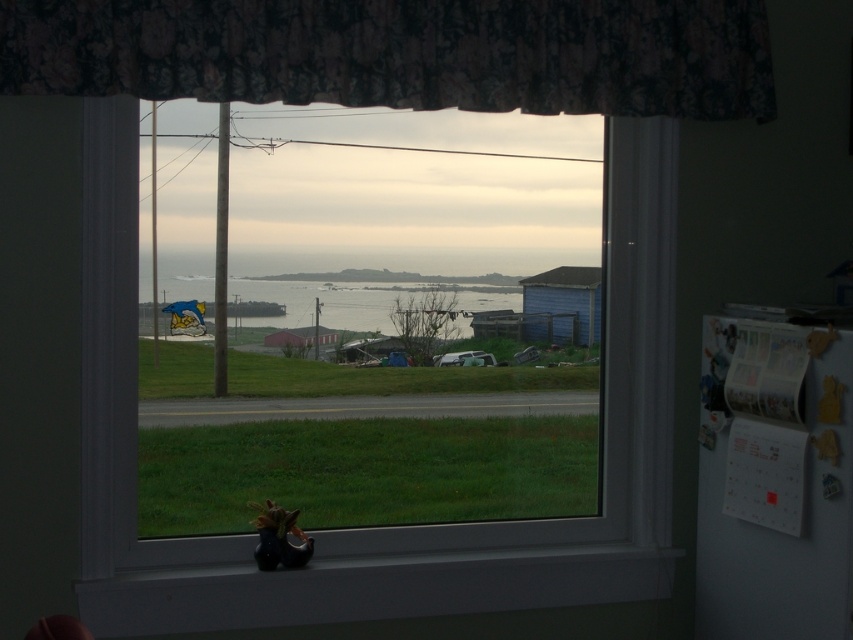
You are an interior designer assessing the placement of the floral fabric curtain at upper center in the window frame. Based on its coordinates, is it positioned closer to the top or bottom edge of the window?

The floral fabric curtain at upper center is located at point (x=402, y=52), which means it is closer to the top edge of the window since the y coordinate is less than 0.5.

Looking at this image, you are an interior designer assessing the room. You need to place a 1.2 meter wide painting on the wall where the transparent glass window at center is located. Given the window and the clear water at center, will the painting fit horizontally without overlapping them?

The transparent glass window at center is wider than the clear water at center. However, the question mentions placing the painting on the wall where the window is located. Since the window itself is part of the wall, the painting must be placed around or beside it. The description does not provide the exact dimensions of the wall or the window, so it is unclear if there is enough space. Please check the actual measurements before deciding.

You are an interior designer assessing the window decorations. You need to know which object is wider between the floral fabric curtain at upper center and the black matte window sill at lower center. Which one is wider?

The floral fabric curtain at upper center is wider than the black matte window sill at lower center according to the description.